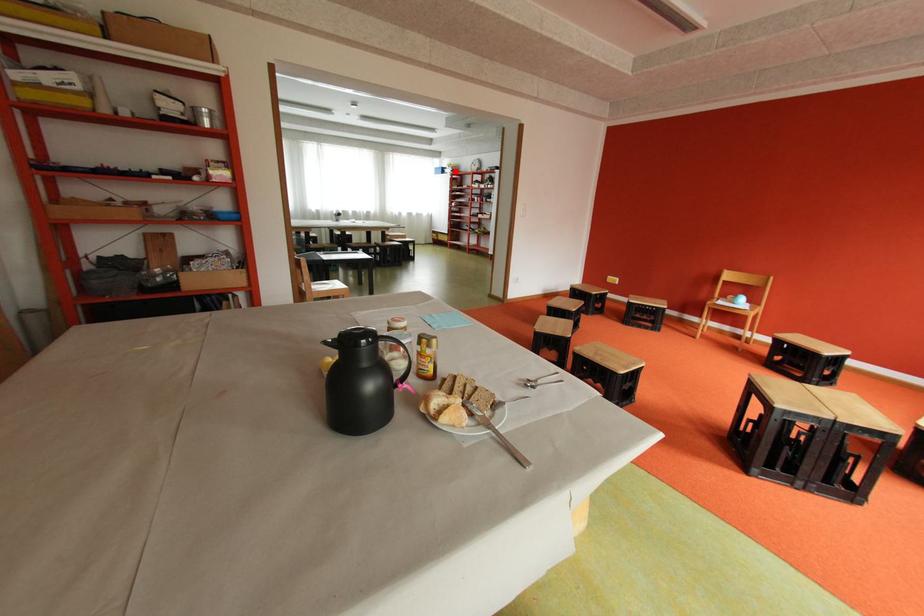
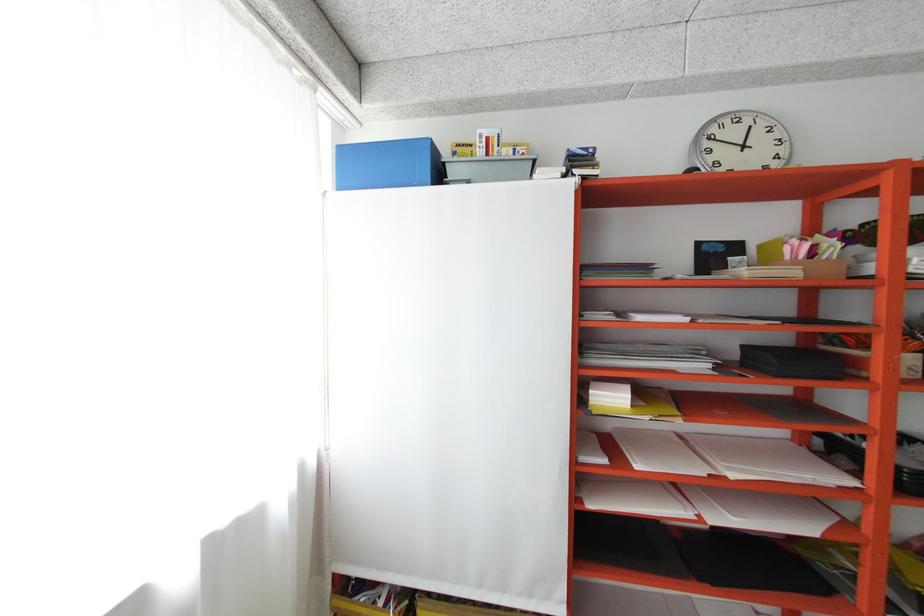
Question: I am providing you with two images of the same scene from different viewpoints. A red point is shown in image1. For the corresponding object point in image2, is it positioned nearer or farther from the camera?

Choices:
 (A) Nearer
 (B) Farther

Answer: (B)